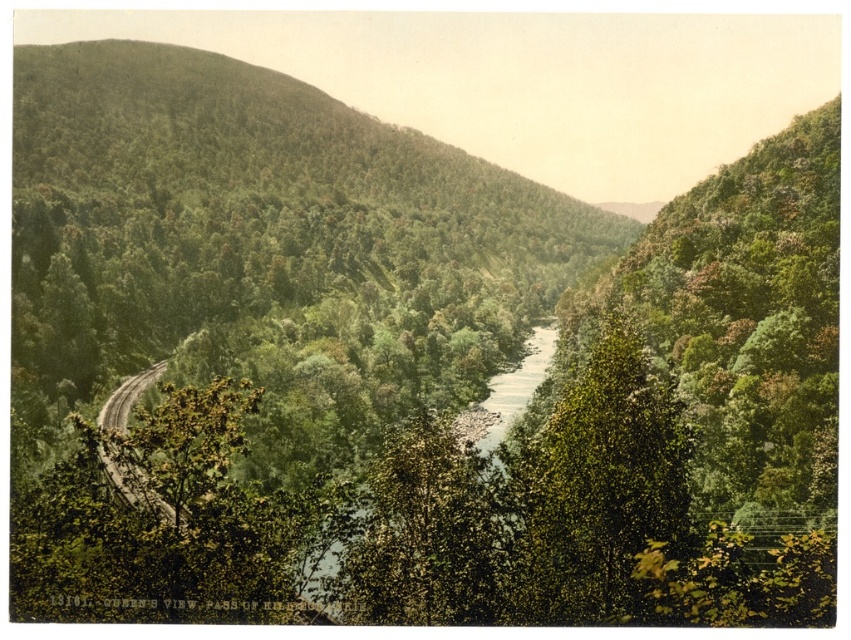
Question: Can you confirm if green leafy tree at center is positioned to the right of green leafy river at center?

Choices:
 (A) no
 (B) yes

Answer: (A)

Question: Is green leafy tree at center smaller than brown gravel road at lower left?

Choices:
 (A) yes
 (B) no

Answer: (A)

Question: Which point appears closest to the camera in this image?

Choices:
 (A) (601, 420)
 (B) (120, 397)
 (C) (530, 346)

Answer: (A)

Question: Which point is closer to the camera?

Choices:
 (A) (110, 470)
 (B) (660, 440)
 (C) (538, 380)

Answer: (B)

Question: Estimate the real-world distances between objects in this image. Which object is closer to the green leafy tree at center?

Choices:
 (A) brown gravel road at lower left
 (B) green leafy river at center

Answer: (A)

Question: Is green leafy tree at center further to camera compared to brown gravel road at lower left?

Choices:
 (A) no
 (B) yes

Answer: (A)